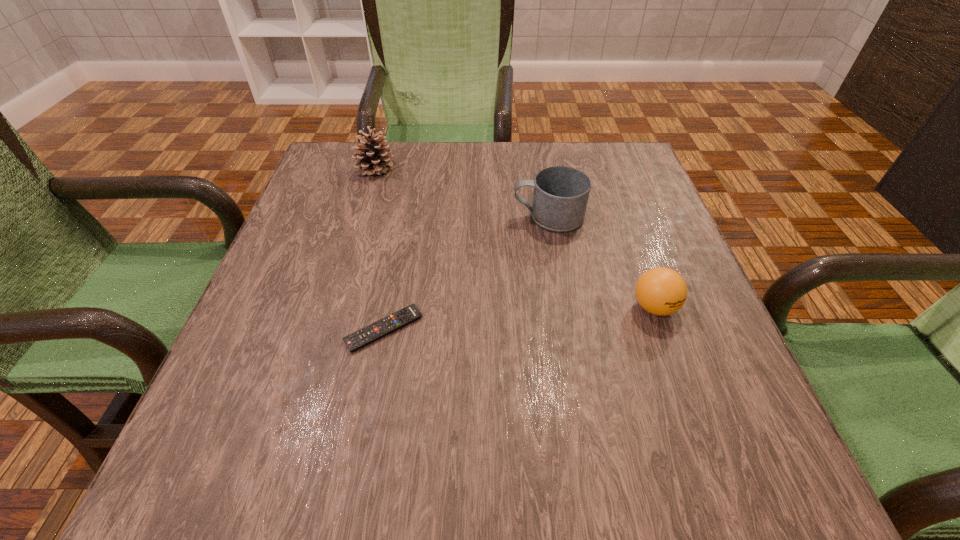
In order to click on free space located 0.400m on the right of the remote control in this screenshot , I will do `click(650, 329)`.

Image resolution: width=960 pixels, height=540 pixels. Identify the location of object at the far edge. (375, 159).

Identify the location of object present at the left edge. (375, 159).

Locate an element on the screen. The height and width of the screenshot is (540, 960). object that is positioned at the right edge is located at coordinates coord(661,291).

What are the coordinates of `object situated at the far left corner` in the screenshot? It's located at (375, 159).

This screenshot has width=960, height=540. I want to click on free region at the far edge, so click(452, 142).

The height and width of the screenshot is (540, 960). In the image, there is a desktop. Find the location of `free space at the left edge`. free space at the left edge is located at coordinates (271, 332).

The image size is (960, 540). Identify the location of free point at the right edge. tap(622, 252).

This screenshot has width=960, height=540. In the image, there is a desktop. What are the coordinates of `vacant region at the far left corner` in the screenshot? It's located at (323, 174).

Locate an element on the screen. Image resolution: width=960 pixels, height=540 pixels. free space at the near left corner of the desktop is located at coordinates (258, 487).